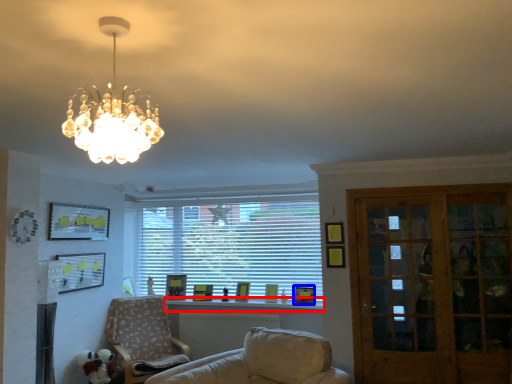
Question: Which of the following is the farthest to the observer, window sill (highlighted by a red box) or picture frame (highlighted by a blue box)?

Choices:
 (A) window sill
 (B) picture frame

Answer: (B)